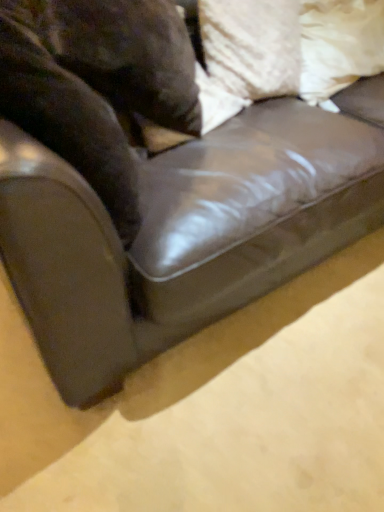
Question: Is white textured pillow at upper right, acting as the second pillow starting from the right, with white fabric pillow at upper right, which is the first pillow in right-to-left order?

Choices:
 (A) no
 (B) yes

Answer: (A)

Question: Is white fabric pillow at upper right, which is the first pillow in right-to-left order, a part of white textured pillow at upper right, acting as the second pillow starting from the right?

Choices:
 (A) yes
 (B) no

Answer: (B)

Question: Considering the relative sizes of white textured pillow at upper right, the 1th pillow when ordered from left to right, and white fabric pillow at upper right, the 2th pillow when ordered from left to right, in the image provided, is white textured pillow at upper right, the 1th pillow when ordered from left to right, wider than white fabric pillow at upper right, the 2th pillow when ordered from left to right,?

Choices:
 (A) yes
 (B) no

Answer: (B)

Question: Can you confirm if white textured pillow at upper right, the 1th pillow when ordered from left to right, is shorter than white fabric pillow at upper right, the 2th pillow when ordered from left to right?

Choices:
 (A) yes
 (B) no

Answer: (A)

Question: Is white textured pillow at upper right, acting as the second pillow starting from the right, at the right side of white fabric pillow at upper right, which is the first pillow in right-to-left order?

Choices:
 (A) yes
 (B) no

Answer: (B)

Question: Based on their positions, is white fabric pillow at upper right, the 2th pillow when ordered from left to right, located to the left or right of brown fur at left?

Choices:
 (A) right
 (B) left

Answer: (A)

Question: From their relative heights in the image, would you say white fabric pillow at upper right, which is the first pillow in right-to-left order, is taller or shorter than brown fur at left?

Choices:
 (A) short
 (B) tall

Answer: (A)

Question: Considering the positions of point (311, 52) and point (94, 177), is point (311, 52) closer or farther from the camera than point (94, 177)?

Choices:
 (A) closer
 (B) farther

Answer: (B)

Question: Based on their sizes in the image, would you say white fabric pillow at upper right, which is the first pillow in right-to-left order, is bigger or smaller than brown fur at left?

Choices:
 (A) small
 (B) big

Answer: (A)

Question: From a real-world perspective, is white fabric pillow at upper right, which is the first pillow in right-to-left order, positioned above or below white textured pillow at upper right, acting as the second pillow starting from the right?

Choices:
 (A) below
 (B) above

Answer: (A)

Question: Does point (367, 37) appear closer or farther from the camera than point (241, 14)?

Choices:
 (A) farther
 (B) closer

Answer: (A)

Question: Based on their positions, is white fabric pillow at upper right, the 2th pillow when ordered from left to right, located to the left or right of white textured pillow at upper right, the 1th pillow when ordered from left to right?

Choices:
 (A) right
 (B) left

Answer: (A)

Question: From the image's perspective, relative to white textured pillow at upper right, the 1th pillow when ordered from left to right, is white fabric pillow at upper right, the 2th pillow when ordered from left to right, above or below?

Choices:
 (A) below
 (B) above

Answer: (B)

Question: Does point (284, 48) appear closer or farther from the camera than point (61, 54)?

Choices:
 (A) farther
 (B) closer

Answer: (A)

Question: From the image's perspective, is white textured pillow at upper right, acting as the second pillow starting from the right, positioned above or below brown fur at left?

Choices:
 (A) below
 (B) above

Answer: (B)